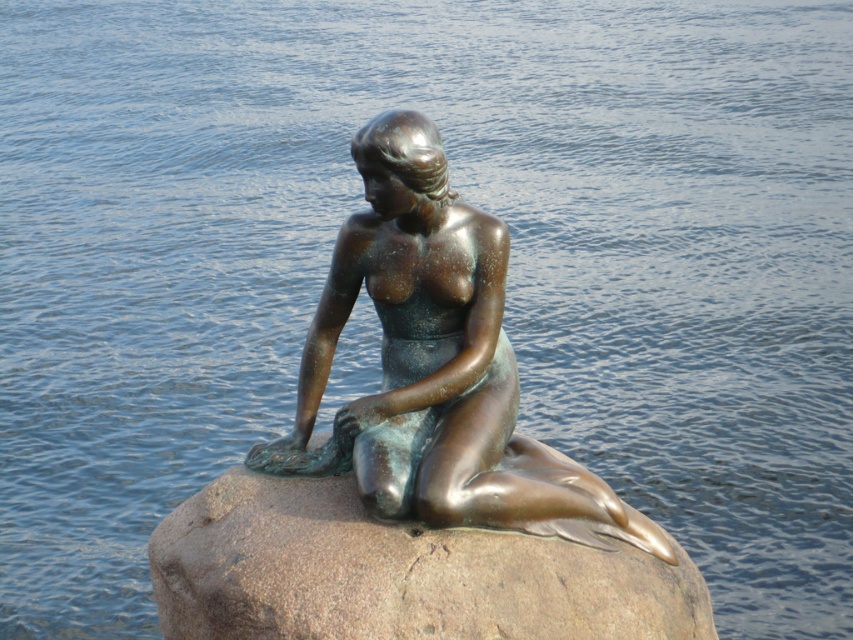
Does point (271, 445) come farther from viewer compared to point (164, 636)?

Yes.

Does point (405, 344) lie in front of point (221, 480)?

Yes, it is.

Measure the distance between bronze statue at center and camera.

The distance of bronze statue at center from camera is 44.68 meters.

Where is `bronze statue at center`? The height and width of the screenshot is (640, 853). bronze statue at center is located at coordinates (436, 365).